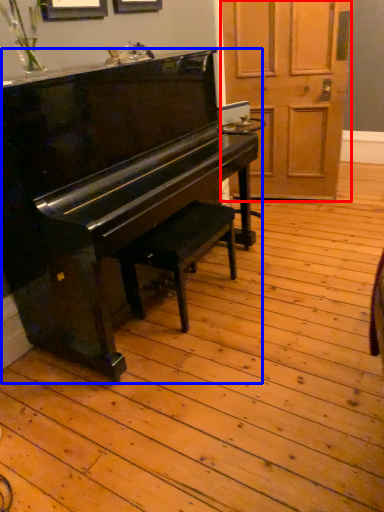
Question: Which of the following is the closest to the observer, screen door (highlighted by a red box) or piano (highlighted by a blue box)?

Choices:
 (A) screen door
 (B) piano

Answer: (B)